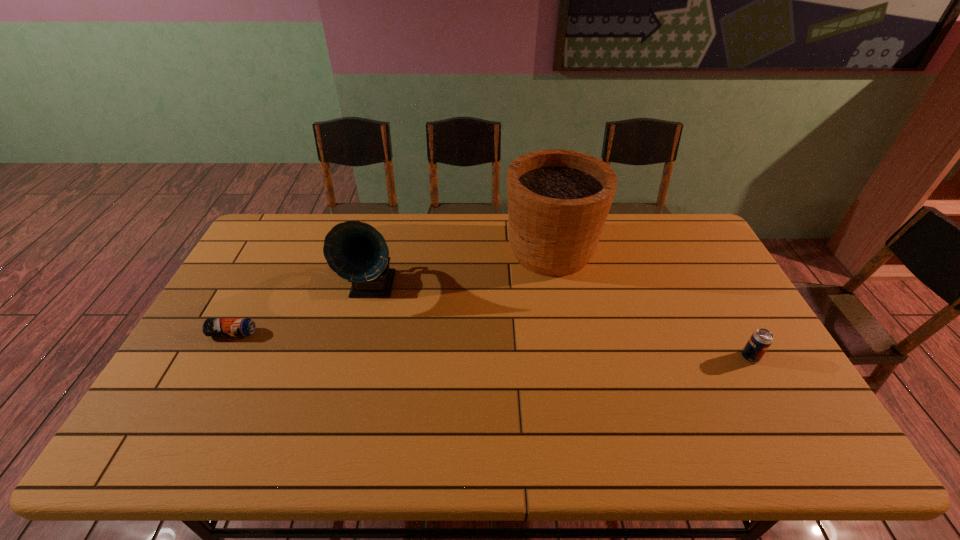
This screenshot has height=540, width=960. What are the coordinates of `flowerpot` in the screenshot? It's located at (558, 200).

Find the location of `phonograph_record`. phonograph_record is located at coordinates tap(357, 252).

Find the location of a particular element. The width and height of the screenshot is (960, 540). the rightmost object is located at coordinates (761, 339).

This screenshot has width=960, height=540. What are the coordinates of `the nearest object` in the screenshot? It's located at (761, 339).

In order to click on the left beer can in this screenshot , I will do `click(212, 326)`.

At what (x,y) coordinates should I click in order to perform the action: click on the third farthest object. Please return your answer as a coordinate pair (x, y). Image resolution: width=960 pixels, height=540 pixels. Looking at the image, I should click on (212, 326).

The image size is (960, 540). In order to click on free region located on the right of the second object from right to left in this screenshot , I will do `click(638, 251)`.

Image resolution: width=960 pixels, height=540 pixels. Identify the location of vacant area situated 0.310m from the horn of the phonograph_record. (343, 401).

Locate an element on the screen. vacant region located on the back of the right beer can is located at coordinates coord(715,294).

The image size is (960, 540). What are the coordinates of `vacant area located 0.080m on the right of the leftmost object` in the screenshot? It's located at (283, 333).